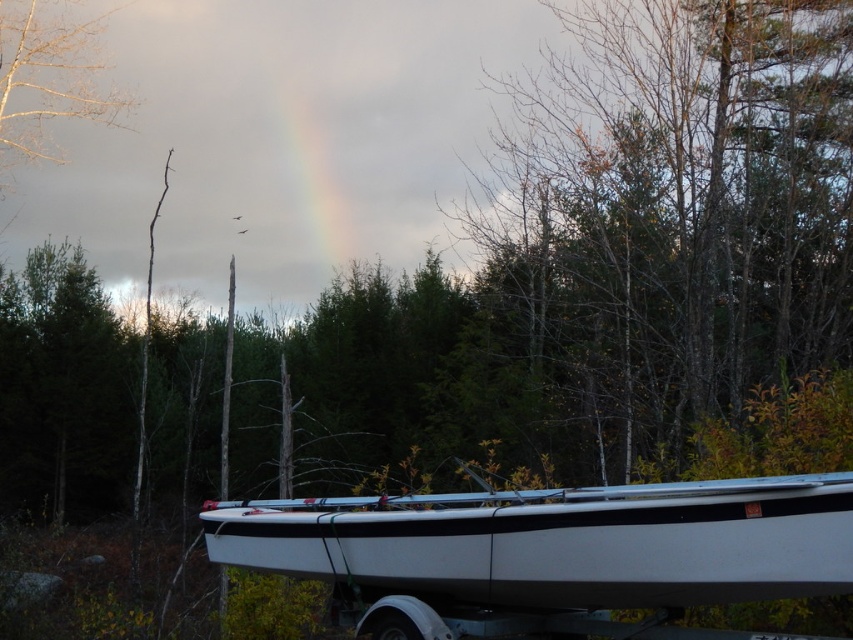
What are the coordinates of the white matte boat at lower center?

The white matte boat at lower center is located at coordinates point [560,541].

You are standing at the point marked by coordinates (674,211) in the image. What object is exactly at this location?

The point at coordinates (674,211) corresponds to the bare branches at center.

You are standing at the camera position looking at the scene. There are two points marked in the image, point (625,147) and point (691,593). Which point is closer to you?

Point (625,147) is further to the camera than point (691,593). Therefore, point (691,593) is closer to you.